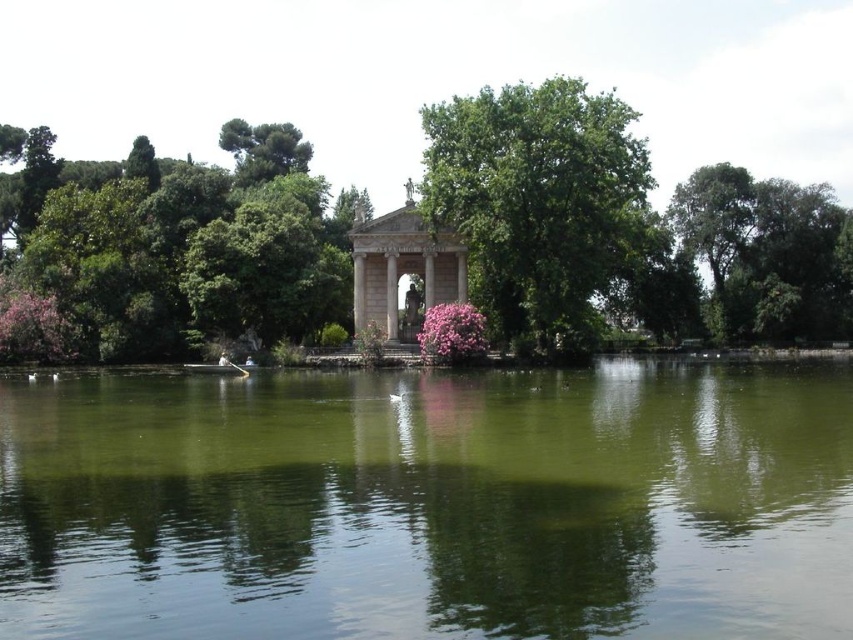
Between point (70, 204) and point (389, 328), which one is positioned behind?

Point (70, 204)

Consider the image. Does green leafy tree at left have a lesser height compared to stone classical gazebo at center?

In fact, green leafy tree at left may be taller than stone classical gazebo at center.

Is point (334, 209) farther from viewer compared to point (460, 257)?

Yes, it is.

At what (x,y) coordinates should I click in order to perform the action: click on green leafy tree at left. Please return your answer as a coordinate pair (x, y). Looking at the image, I should click on (173, 250).

Does green reflective water at center appear on the left side of stone classical gazebo at center?

Incorrect, green reflective water at center is not on the left side of stone classical gazebo at center.

Is green reflective water at center bigger than stone classical gazebo at center?

Indeed, green reflective water at center has a larger size compared to stone classical gazebo at center.

Between point (485, 570) and point (444, 243), which one is positioned in front?

Point (485, 570)

Where is `green reflective water at center`? The width and height of the screenshot is (853, 640). green reflective water at center is located at coordinates (428, 504).

Is the position of green leafy tree at center less distant than that of stone classical gazebo at center?

Yes, green leafy tree at center is in front of stone classical gazebo at center.

Between point (625, 141) and point (415, 330), which one is positioned in front?

Point (625, 141) is more forward.

Image resolution: width=853 pixels, height=640 pixels. What do you see at coordinates (538, 204) in the screenshot?
I see `green leafy tree at center` at bounding box center [538, 204].

Find the location of a particular element. green leafy tree at center is located at coordinates (538, 204).